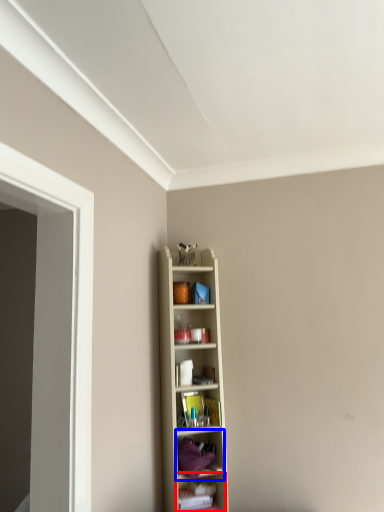
Question: Which point is further to the camera, shelf (highlighted by a red box) or shelf (highlighted by a blue box)?

Choices:
 (A) shelf
 (B) shelf

Answer: (A)